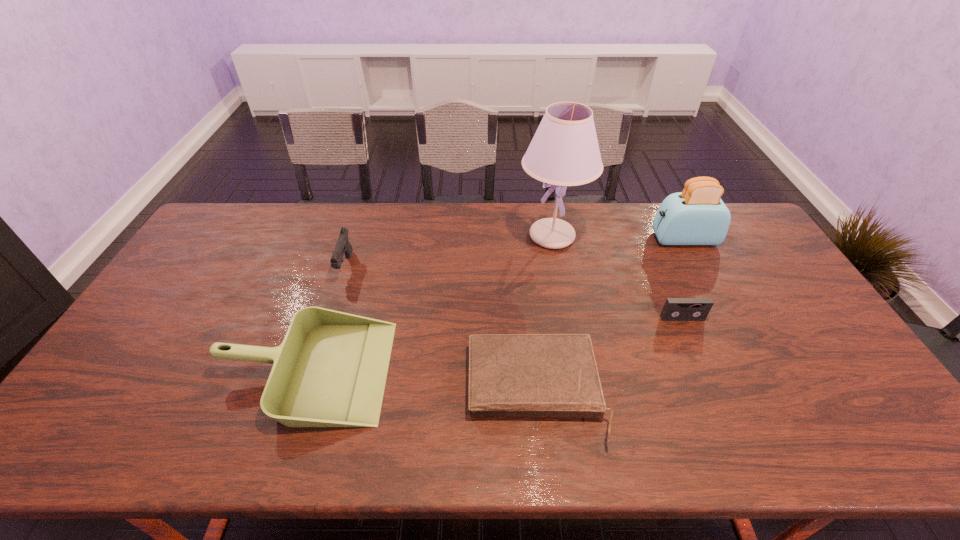
In order to click on the tallest object in this screenshot , I will do `click(564, 151)`.

Image resolution: width=960 pixels, height=540 pixels. I want to click on the second tallest object, so click(696, 216).

This screenshot has height=540, width=960. In order to click on pistol in this screenshot , I will do `click(343, 245)`.

Where is `dustpan`? dustpan is located at coordinates (330, 371).

Find the location of `the second shortest object`. the second shortest object is located at coordinates (675, 309).

Find the location of a particular element. paperback book is located at coordinates (539, 375).

Where is `vacant space located on the left of the lampshade`? This screenshot has height=540, width=960. vacant space located on the left of the lampshade is located at coordinates (420, 236).

I want to click on free region located on the side of the toaster with the lever, so click(620, 239).

At what (x,y) coordinates should I click in order to perform the action: click on free space located on the side of the toaster with the lever. Please return your answer as a coordinate pair (x, y). The width and height of the screenshot is (960, 540). Looking at the image, I should click on (545, 239).

I want to click on vacant area situated on the side of the toaster with the lever, so click(565, 239).